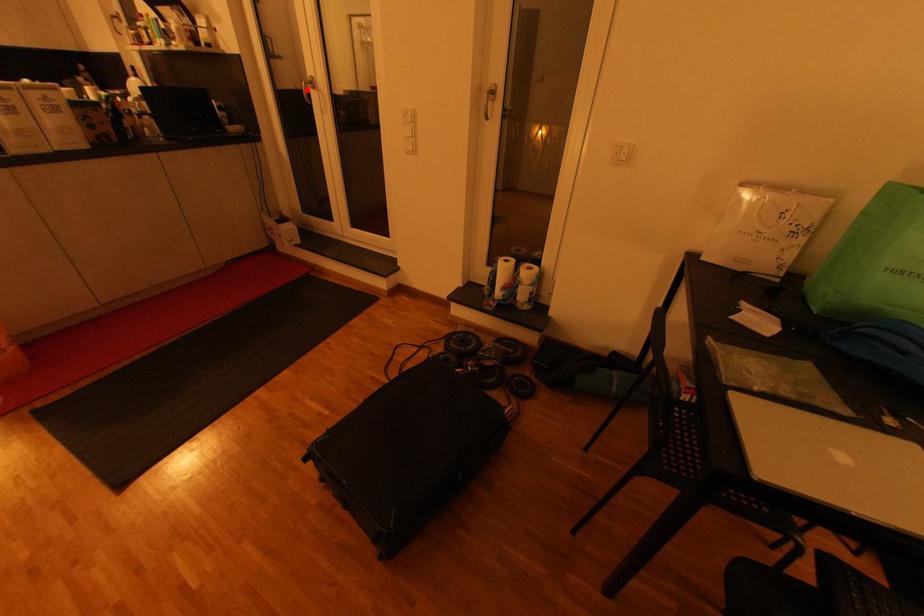
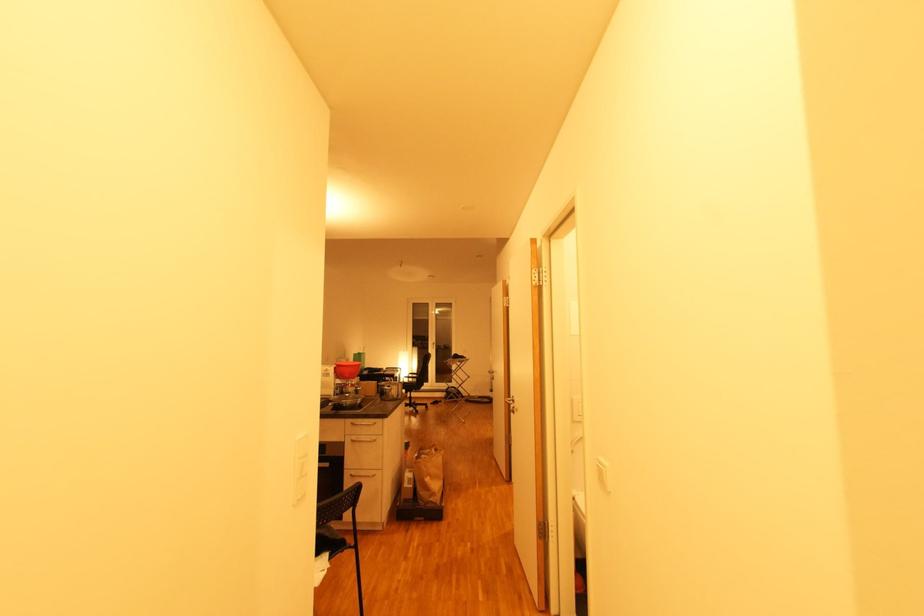
Question: I am providing you with two images of the same scene from different viewpoints. A red point is marked on the first image. Is the red point's position out of view in image 2?

Choices:
 (A) Yes
 (B) No

Answer: (A)